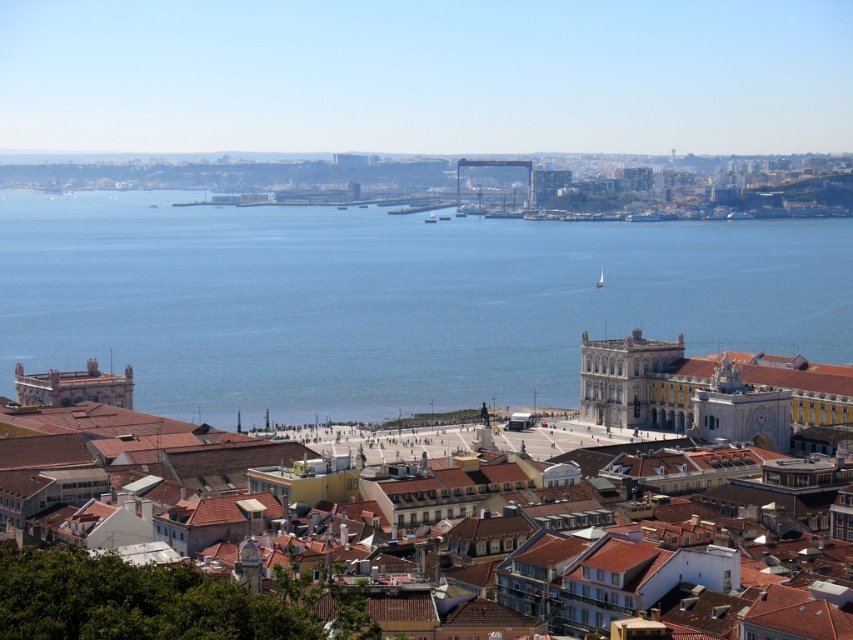
Question: Does blue water at center have a greater width compared to yellow stone building at center?

Choices:
 (A) yes
 (B) no

Answer: (A)

Question: Does blue water at center appear on the left side of yellow stone building at center?

Choices:
 (A) no
 (B) yes

Answer: (A)

Question: Is blue water at center smaller than yellow stone building at center?

Choices:
 (A) no
 (B) yes

Answer: (A)